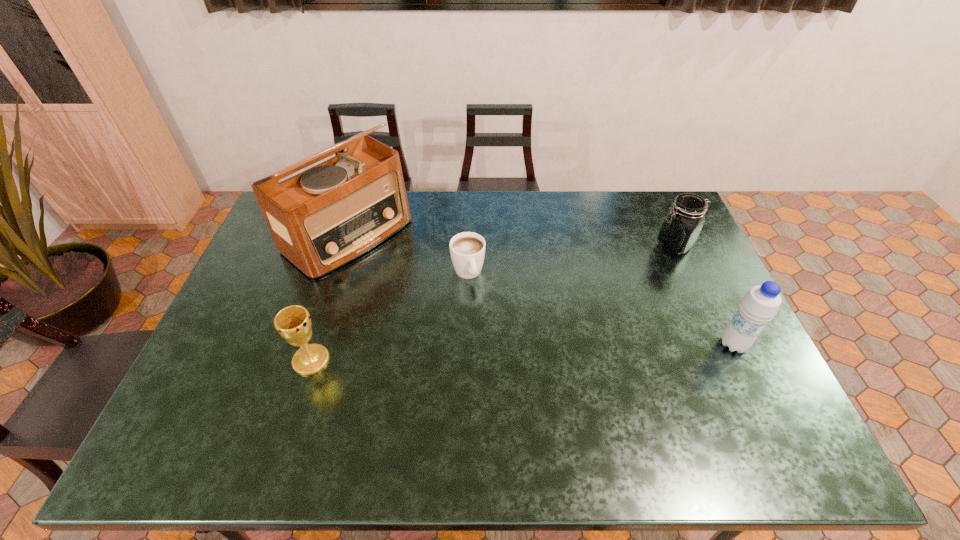
At what (x,y) coordinates should I click in order to perform the action: click on free space on the desktop that is between the chalice and the water bottle and is positioned on the lid of the jar. Please return your answer as a coordinate pair (x, y). This screenshot has height=540, width=960. Looking at the image, I should click on (538, 352).

The height and width of the screenshot is (540, 960). In order to click on vacant space on the desktop that is between the chalice and the water bottle and is positioned with the handle on the side of the shortest object in this screenshot , I will do `click(496, 353)`.

Image resolution: width=960 pixels, height=540 pixels. Find the location of `free space on the desktop that is between the chalice and the fourth shortest object and is positioned on the front panel of the radio receiver`. free space on the desktop that is between the chalice and the fourth shortest object and is positioned on the front panel of the radio receiver is located at coordinates (511, 353).